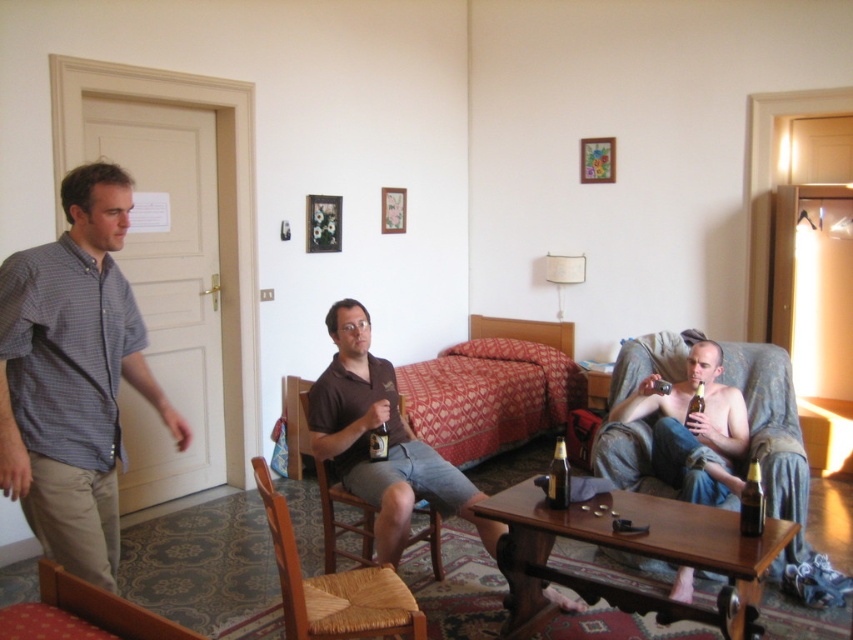
You are trying to decide where to place a large rectangular box that is 1.2 meters wide. You have two options in the room where you are standing. The options are the denim fabric couch at lower right and the wooden woven chair at lower left. Which of these two items can the box fit next to without overlapping?

The denim fabric couch at lower right is wider than the wooden woven chair at lower left, so the box can fit next to the denim fabric couch at lower right.

You are standing in the hotel room and want to pick up an item from the coffee table. You notice two points marked in the image. Which point is closer to you, point [751,445] or point [21,632]?

Point [751,445] is further to the camera than point [21,632], so the closer point to you is point [21,632].

You are a guest in this hotel room and want to sit down. You see the denim fabric couch at lower right and the wooden woven chair at lower left. Which piece of furniture is closer to you so you can sit on it without moving further into the room?

The denim fabric couch at lower right is closer to you than the wooden woven chair at lower left, so you can sit on it without moving further into the room.